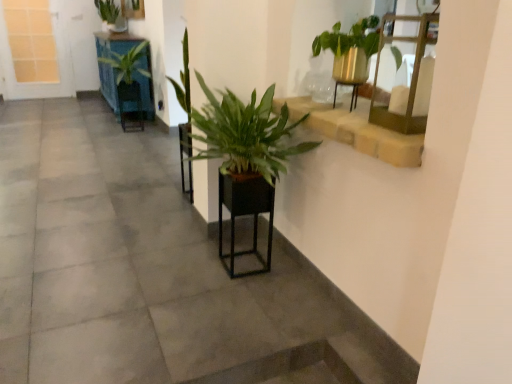
Locate an element on the screen. free spot to the left of black matte planter at center, which is the 3th armchair in top-to-bottom order is located at coordinates (199, 264).